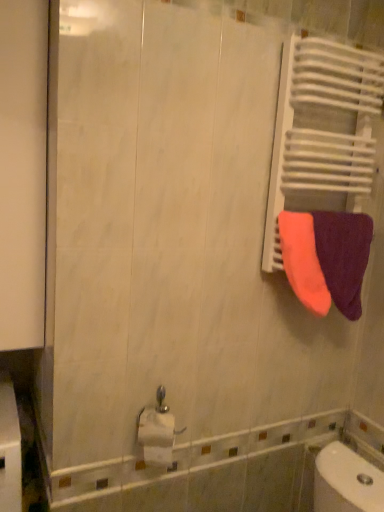
Question: Is neon orange fabric at right, positioned as the second towel in right-to-left order, facing towards orange terry cloth towel at right, which ranks as the 1th towel in right-to-left order?

Choices:
 (A) yes
 (B) no

Answer: (B)

Question: Does neon orange fabric at right, positioned as the second towel in right-to-left order, touch orange terry cloth towel at right, which ranks as the 2th towel in left-to-right order?

Choices:
 (A) no
 (B) yes

Answer: (B)

Question: Does neon orange fabric at right, which is the 1th towel in left-to-right order, appear on the left side of orange terry cloth towel at right, which ranks as the 1th towel in right-to-left order?

Choices:
 (A) yes
 (B) no

Answer: (A)

Question: Is orange terry cloth towel at right, which ranks as the 2th towel in left-to-right order, at the back of neon orange fabric at right, which is the 1th towel in left-to-right order?

Choices:
 (A) no
 (B) yes

Answer: (A)

Question: From a real-world perspective, is neon orange fabric at right, positioned as the second towel in right-to-left order, beneath orange terry cloth towel at right, which ranks as the 2th towel in left-to-right order?

Choices:
 (A) yes
 (B) no

Answer: (B)

Question: From the image's perspective, is neon orange fabric at right, positioned as the second towel in right-to-left order, beneath orange terry cloth towel at right, which ranks as the 1th towel in right-to-left order?

Choices:
 (A) no
 (B) yes

Answer: (A)

Question: Does white glossy toilet paper at lower center have a lesser width compared to orange terry cloth towel at right, which ranks as the 2th towel in left-to-right order?

Choices:
 (A) yes
 (B) no

Answer: (A)

Question: Is white glossy toilet paper at lower center to the right of orange terry cloth towel at right, which ranks as the 2th towel in left-to-right order, from the viewer's perspective?

Choices:
 (A) yes
 (B) no

Answer: (B)

Question: Is white glossy toilet paper at lower center facing towards orange terry cloth towel at right, which ranks as the 2th towel in left-to-right order?

Choices:
 (A) yes
 (B) no

Answer: (B)

Question: Is orange terry cloth towel at right, which ranks as the 2th towel in left-to-right order, located within white glossy toilet paper at lower center?

Choices:
 (A) yes
 (B) no

Answer: (B)

Question: From a real-world perspective, is white glossy toilet paper at lower center physically above orange terry cloth towel at right, which ranks as the 1th towel in right-to-left order?

Choices:
 (A) yes
 (B) no

Answer: (B)

Question: Is white glossy toilet paper at lower center located outside orange terry cloth towel at right, which ranks as the 2th towel in left-to-right order?

Choices:
 (A) yes
 (B) no

Answer: (A)

Question: Can you confirm if white glossy toilet paper at lower center is thinner than neon orange fabric at right, positioned as the second towel in right-to-left order?

Choices:
 (A) no
 (B) yes

Answer: (A)